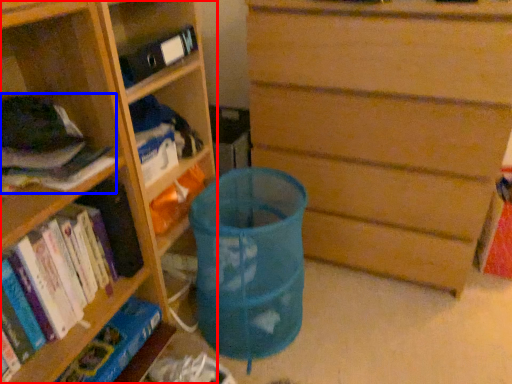
Question: Which point is further to the camera, shelf (highlighted by a red box) or book (highlighted by a blue box)?

Choices:
 (A) shelf
 (B) book

Answer: (A)